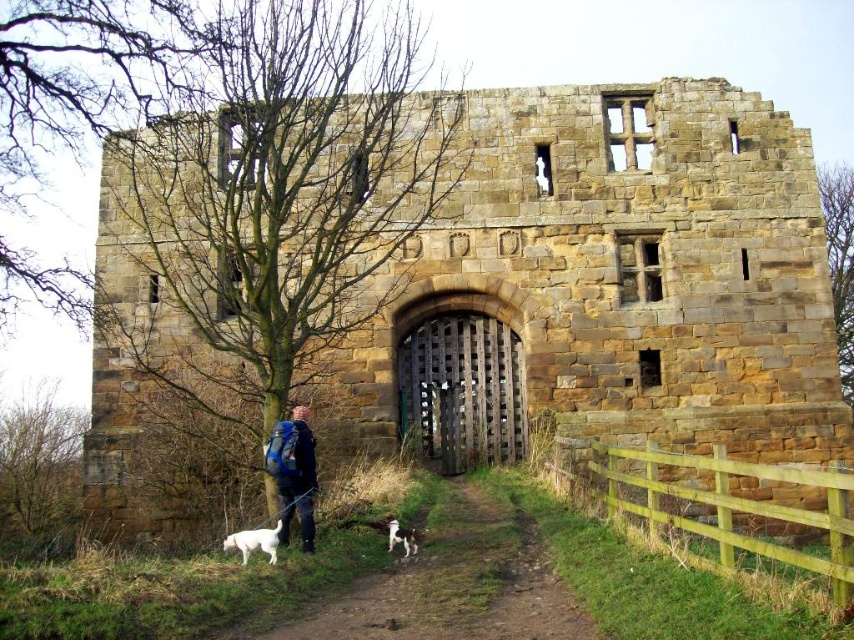
You are standing at the entrance of the historic stone structure and want to take a photo of the brown stone gate at center. Where should you position yourself to capture the gate at the coordinates point (x=615, y=280)?

The brown stone gate at center is located at point (x=615, y=280), so you should position yourself directly in front of the entrance to capture the gate at those coordinates.

You are standing at the entrance of the historic stone structure and want to walk along the brown dirt path at lower center to reach the gate. However, there is a white fur dog at lower left blocking your way. Based on their positions, can you walk around the dog without stepping off the path?

The brown dirt path at lower center is positioned under the white fur dog at lower left, meaning the dog is directly on top of the path. To avoid stepping off the path, you would need to move the dog or wait for it to move aside before proceeding.